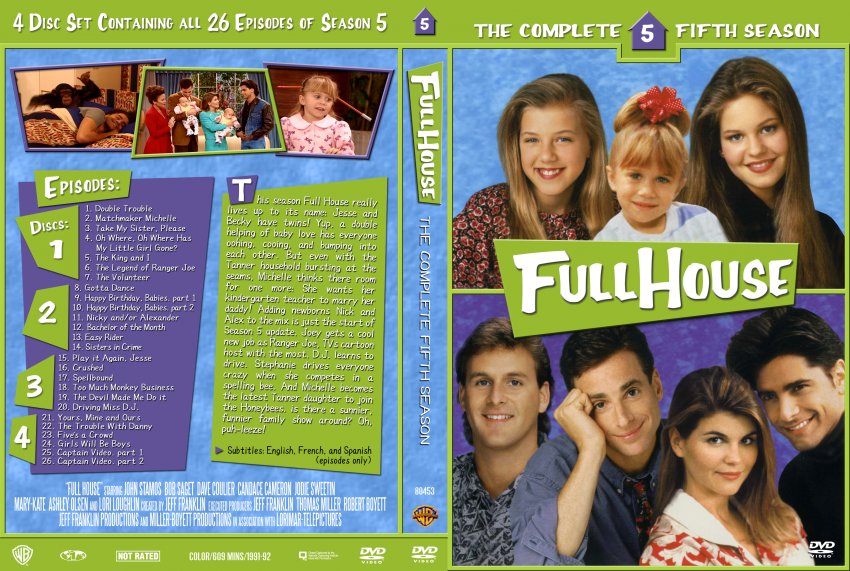
Locate an element on the screen. This screenshot has width=850, height=571. dvd is located at coordinates (455, 276), (370, 553), (421, 552), (825, 546).